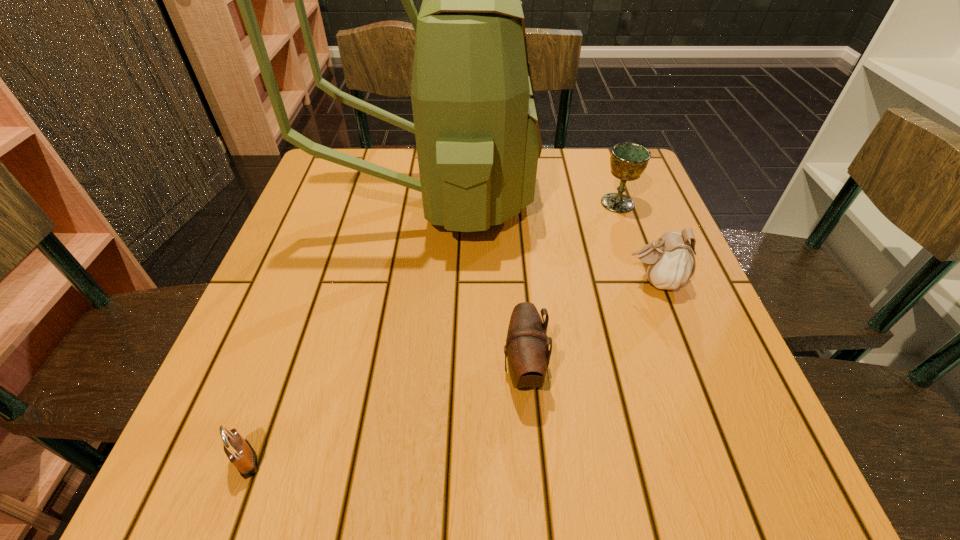
The height and width of the screenshot is (540, 960). Find the location of `backpack that is at the left edge`. backpack that is at the left edge is located at coordinates (476, 125).

Image resolution: width=960 pixels, height=540 pixels. Find the location of `padlock located at the left edge`. padlock located at the left edge is located at coordinates (241, 454).

Locate an element on the screen. chalice that is at the right edge is located at coordinates (628, 161).

Locate an element on the screen. This screenshot has width=960, height=540. pouch situated at the right edge is located at coordinates (669, 262).

Locate an element on the screen. This screenshot has height=540, width=960. object present at the far left corner is located at coordinates (476, 125).

At what (x,y) coordinates should I click in order to perform the action: click on object present at the near left corner. Please return your answer as a coordinate pair (x, y). Looking at the image, I should click on (241, 454).

Image resolution: width=960 pixels, height=540 pixels. Identify the location of object positioned at the far right corner. (628, 161).

In the image, there is a desktop. Where is `free space at the far edge`? The height and width of the screenshot is (540, 960). free space at the far edge is located at coordinates (553, 151).

Locate an element on the screen. vacant region at the near edge is located at coordinates (444, 448).

You are a GUI agent. You are given a task and a screenshot of the screen. Output one action in this format:
    pyautogui.click(x=<x>, y=<y>)
    Task: Click on the free spot at the left edge of the desktop
    The width and height of the screenshot is (960, 540).
    Given the screenshot: What is the action you would take?
    pyautogui.click(x=353, y=228)